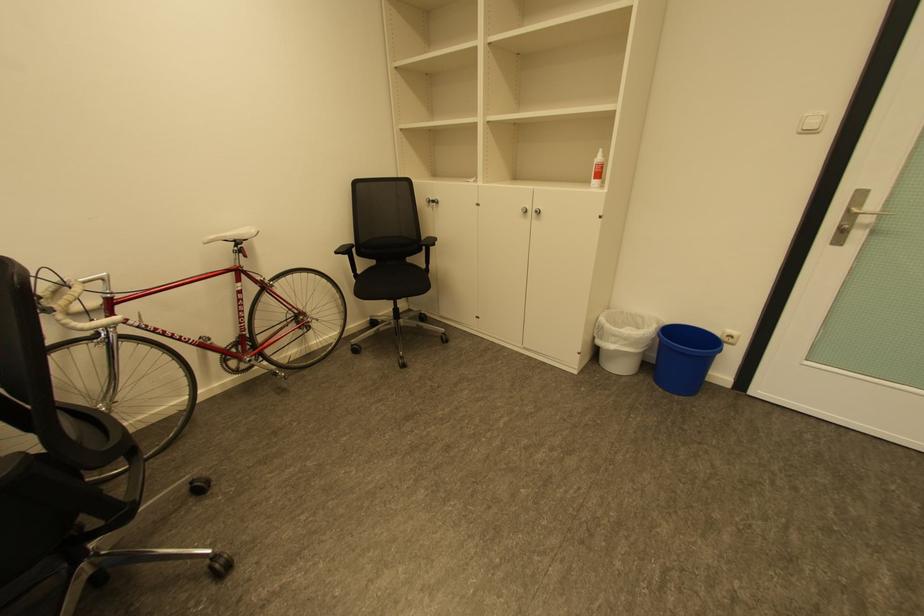
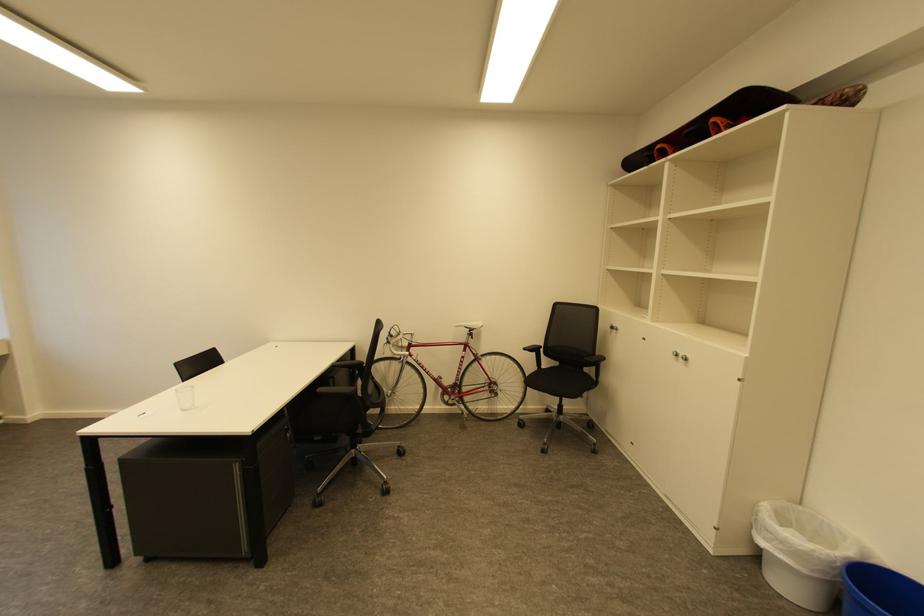
Find the pixel in the second image that matches point 344,253 in the first image.

(531, 350)